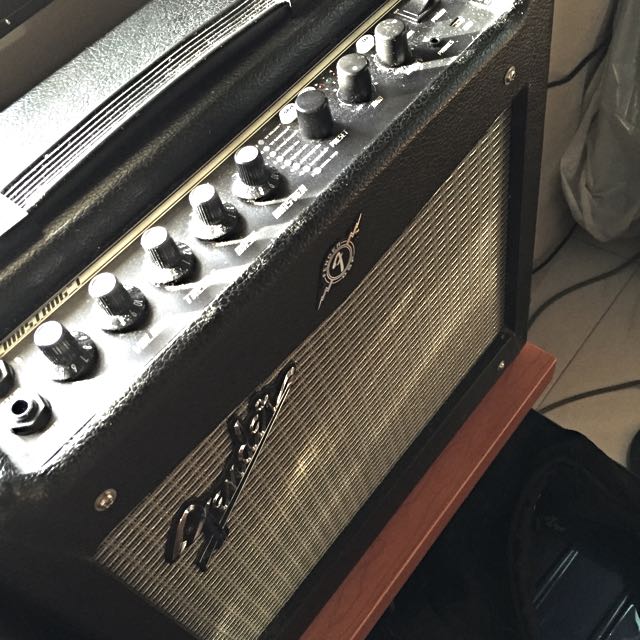
You are a GUI agent. You are given a task and a screenshot of the screen. Output one action in this format:
    pyautogui.click(x=<x>, y=<y>)
    Task: Click on the knobs
    Image resolution: width=640 pixels, height=640 pixels.
    Given the screenshot: What is the action you would take?
    pyautogui.click(x=58, y=336), pyautogui.click(x=106, y=285), pyautogui.click(x=164, y=249), pyautogui.click(x=205, y=198), pyautogui.click(x=258, y=164), pyautogui.click(x=310, y=106), pyautogui.click(x=355, y=77), pyautogui.click(x=397, y=43)